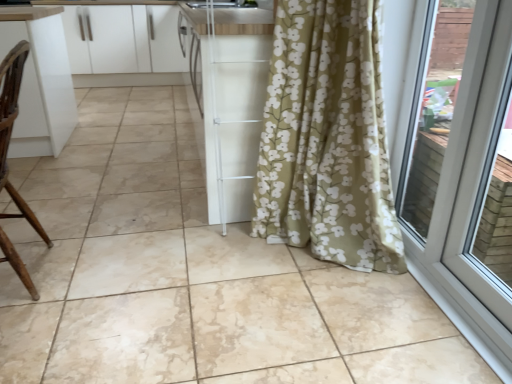
Question: Can you confirm if brown wood chair at left is smaller than white plastic door at right?

Choices:
 (A) yes
 (B) no

Answer: (B)

Question: Is brown wood chair at left facing towards white plastic door at right?

Choices:
 (A) no
 (B) yes

Answer: (A)

Question: Considering the relative positions of brown wood chair at left and white plastic door at right in the image provided, is brown wood chair at left to the right of white plastic door at right from the viewer's perspective?

Choices:
 (A) no
 (B) yes

Answer: (A)

Question: Considering the relative positions of brown wood chair at left and white plastic door at right in the image provided, is brown wood chair at left to the left of white plastic door at right from the viewer's perspective?

Choices:
 (A) no
 (B) yes

Answer: (B)

Question: Does brown wood chair at left have a greater width compared to white plastic door at right?

Choices:
 (A) no
 (B) yes

Answer: (B)

Question: Is point (426, 291) closer or farther from the camera than point (14, 200)?

Choices:
 (A) farther
 (B) closer

Answer: (B)

Question: Is white plastic door at right to the left or to the right of brown wood chair at left in the image?

Choices:
 (A) left
 (B) right

Answer: (B)

Question: From their relative heights in the image, would you say white plastic door at right is taller or shorter than brown wood chair at left?

Choices:
 (A) short
 (B) tall

Answer: (B)

Question: From a real-world perspective, is white plastic door at right above or below brown wood chair at left?

Choices:
 (A) above
 (B) below

Answer: (A)

Question: In terms of size, does white glossy cabinets at upper left appear bigger or smaller than white plastic door at right?

Choices:
 (A) big
 (B) small

Answer: (A)

Question: In terms of width, does white glossy cabinets at upper left look wider or thinner when compared to white plastic door at right?

Choices:
 (A) wide
 (B) thin

Answer: (A)

Question: Is white glossy cabinets at upper left in front of or behind white plastic door at right in the image?

Choices:
 (A) front
 (B) behind

Answer: (B)

Question: Does point (79, 34) appear closer or farther from the camera than point (472, 57)?

Choices:
 (A) farther
 (B) closer

Answer: (A)

Question: Is point (2, 94) closer or farther from the camera than point (408, 64)?

Choices:
 (A) farther
 (B) closer

Answer: (B)

Question: From a real-world perspective, is brown wood chair at left physically located above or below white plastic door at right?

Choices:
 (A) above
 (B) below

Answer: (B)